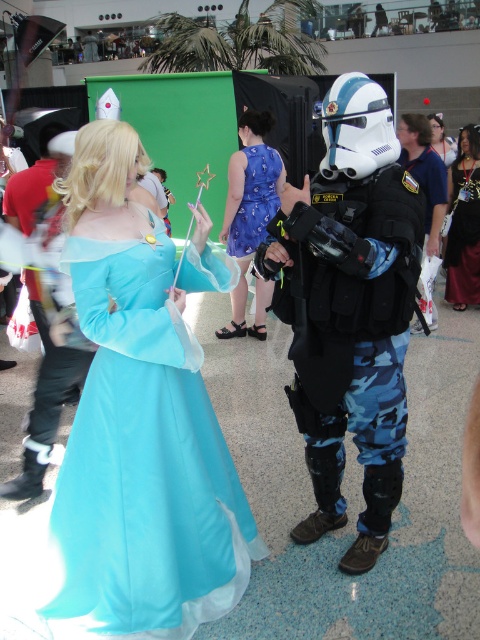
Question: Estimate the real-world distances between objects in this image. Which object is farther from the matte blue costume at center?

Choices:
 (A) blue satin dress at center
 (B) matte black hair at upper center
 (C) matte blue fabric dress at center

Answer: (B)

Question: Can you confirm if matte blue fabric dress at center is wider than matte black hair at upper center?

Choices:
 (A) no
 (B) yes

Answer: (A)

Question: Which object appears closest to the camera in this image?

Choices:
 (A) blue printed fabric dress at center
 (B) matte blue fabric dress at center
 (C) matte black hair at upper center
 (D) blue satin dress at center

Answer: (B)

Question: Is matte blue fabric dress at center in front of matte blue costume at center?

Choices:
 (A) yes
 (B) no

Answer: (A)

Question: Does matte blue costume at center have a larger size compared to blue satin dress at center?

Choices:
 (A) no
 (B) yes

Answer: (A)

Question: Which of the following is the farthest from the observer?

Choices:
 (A) camo-patterned armor at center
 (B) blue satin dress at center
 (C) camouflage pants at center

Answer: (B)